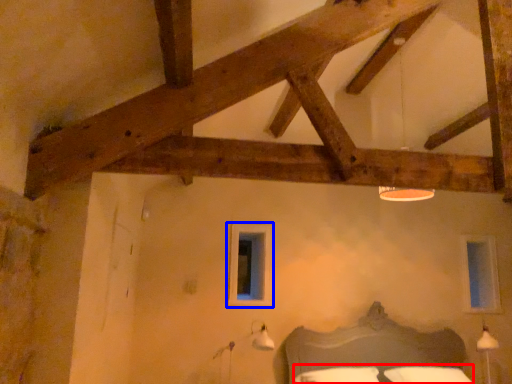
Question: Which object appears farthest to the camera in this image, bedding (highlighted by a red box) or window (highlighted by a blue box)?

Choices:
 (A) bedding
 (B) window

Answer: (B)